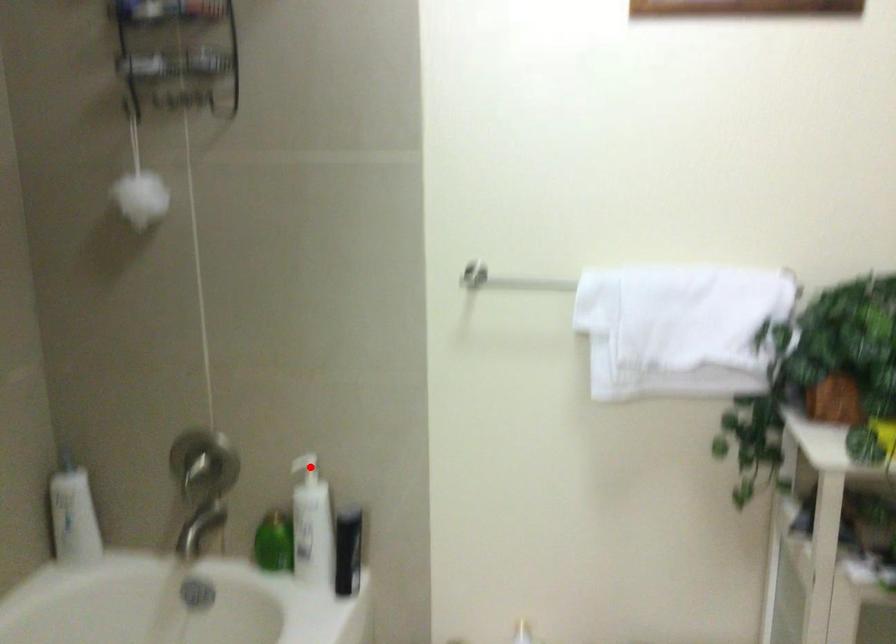
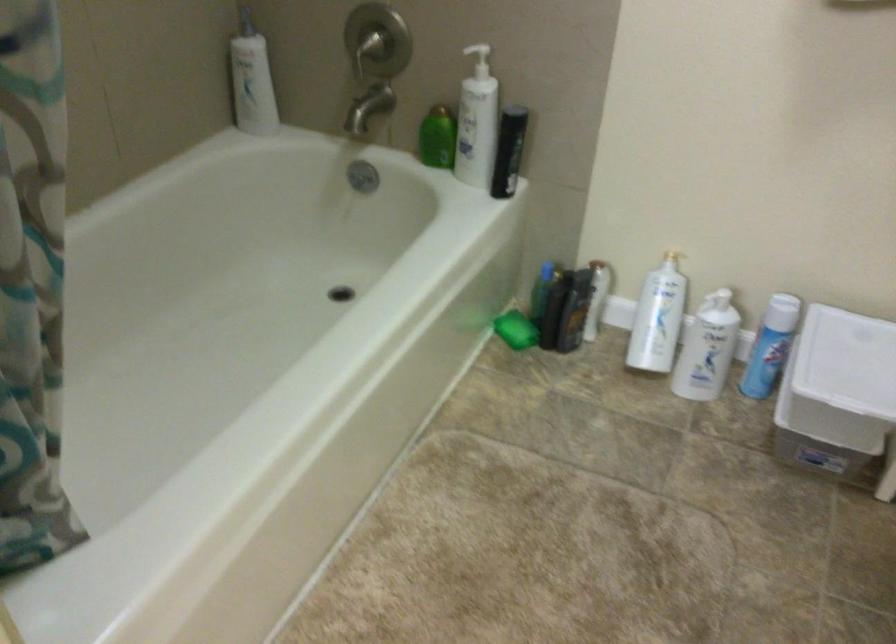
Where in the second image is the point corresponding to the highlighted location from the first image?

(478, 57)